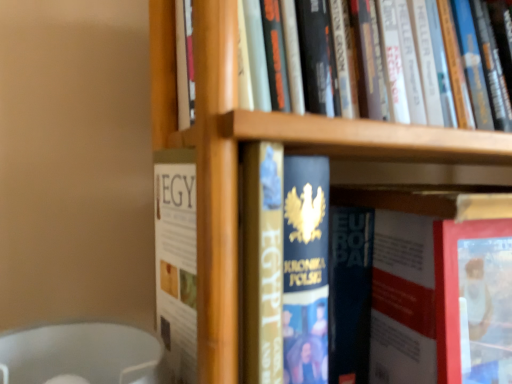
Question: Is hardcover book at center, the third book from the bottom, spatially inside gold foil book at center, which appears as the second book when ordered from the bottom, or outside of it?

Choices:
 (A) outside
 (B) inside

Answer: (A)

Question: From a real-world perspective, is hardcover book at center, the third book from the bottom, positioned above or below gold foil book at center, acting as the third book starting from the top?

Choices:
 (A) below
 (B) above

Answer: (B)

Question: Which of these objects is positioned closest to the gold foil book at center, acting as the third book starting from the top?

Choices:
 (A) hardcover book at center
 (B) hardcover books at upper center, the fourth book from the bottom
 (C) hardcover book at center, placed as the fourth book when sorted from top to bottom
 (D) hardcover book at center, which appears as the second book when viewed from the top

Answer: (D)

Question: Which object is positioned farthest from the hardcover book at center, the third book from the bottom?

Choices:
 (A) hardcover books at upper center, the fourth book from the bottom
 (B) hardcover book at center, placed as the fourth book when sorted from top to bottom
 (C) gold foil book at center, acting as the third book starting from the top
 (D) hardcover book at center

Answer: (D)